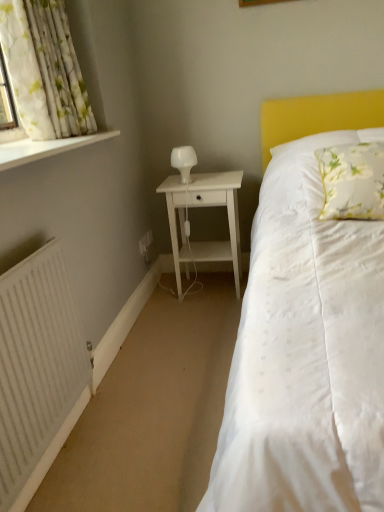
Where is `free region under white matte radiator at lower left (from a real-world perspective)`? The width and height of the screenshot is (384, 512). free region under white matte radiator at lower left (from a real-world perspective) is located at coordinates (68, 454).